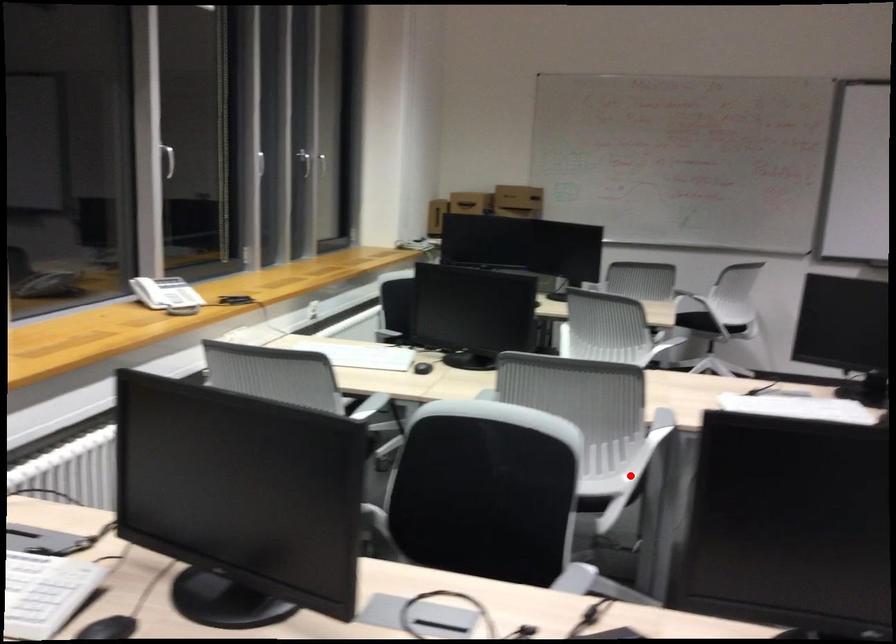
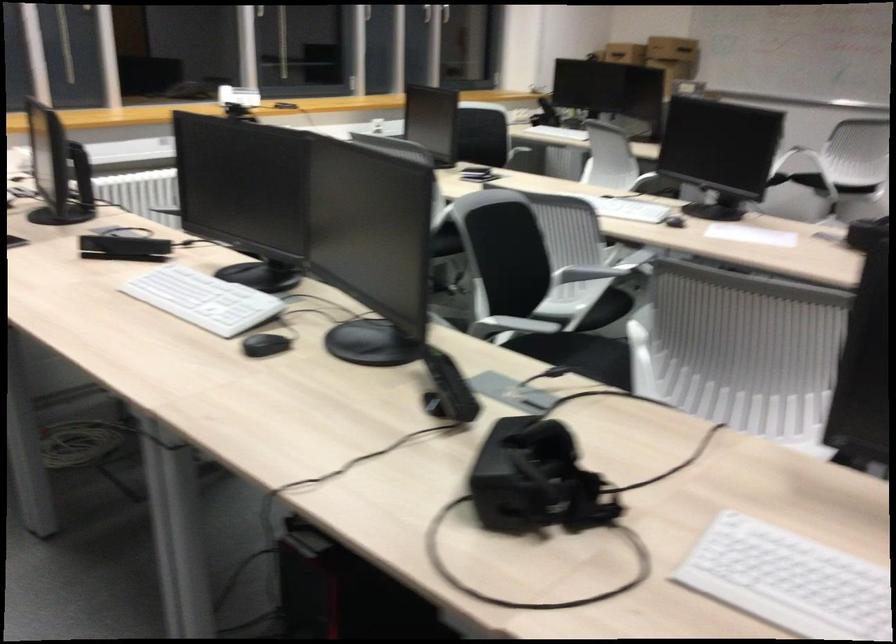
Question: A red point is marked in image1. In image2, is the corresponding 3D point closer to the camera or farther? Reply with the corresponding letter.

Choices:
 (A) The corresponding 3D point is closer.
 (B) The corresponding 3D point is farther.

Answer: (B)